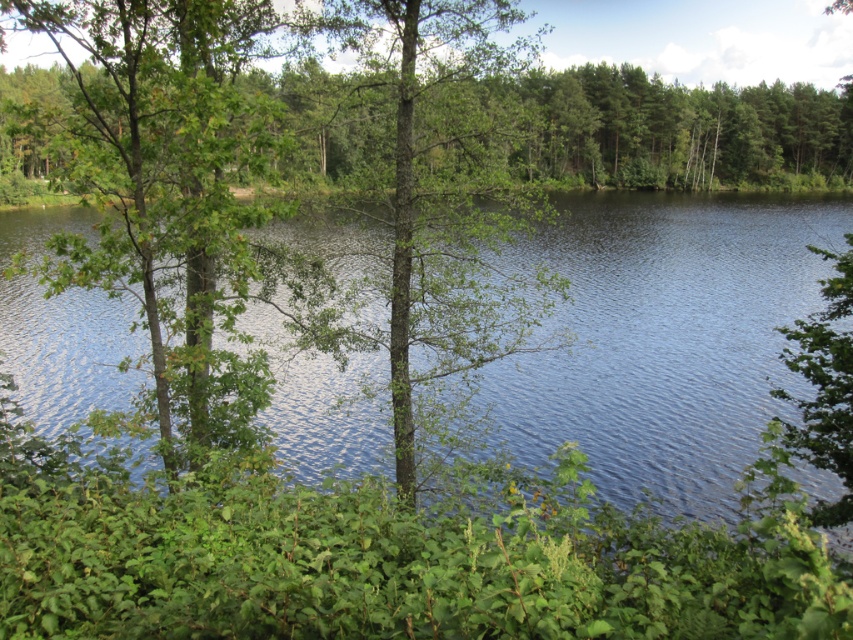
Question: Can you confirm if blue water at center is positioned above green leafy tree at left?

Choices:
 (A) no
 (B) yes

Answer: (A)

Question: Considering the real-world distances, which object is farthest from the blue water at center?

Choices:
 (A) green leafy tree at left
 (B) green rough bark tree at center

Answer: (B)

Question: Can you confirm if green leafy tree at left is bigger than green rough bark tree at center?

Choices:
 (A) yes
 (B) no

Answer: (A)

Question: Which of the following is the farthest from the observer?

Choices:
 (A) green leafy tree at left
 (B) blue water at center
 (C) green rough bark tree at center

Answer: (C)

Question: Does green leafy tree at left appear on the left side of green rough bark tree at center?

Choices:
 (A) no
 (B) yes

Answer: (B)

Question: Which object is the closest to the green leafy tree at left?

Choices:
 (A) blue water at center
 (B) green rough bark tree at center

Answer: (B)